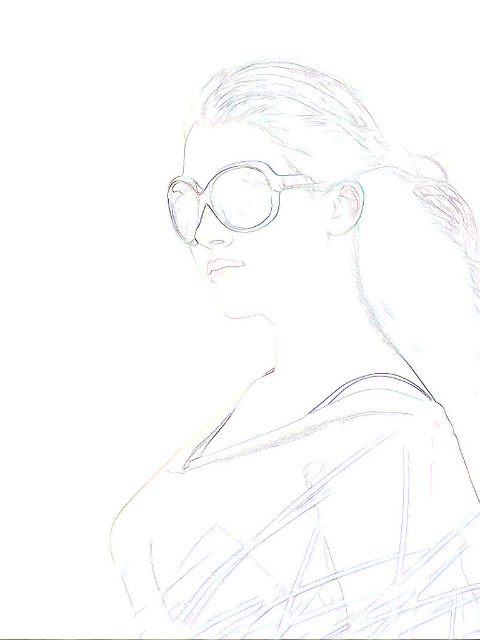
Which is below, matte plastic glasses at center or clear plastic glasses at center?

matte plastic glasses at center

Is matte plastic glasses at center shorter than clear plastic glasses at center?

Incorrect, matte plastic glasses at center's height does not fall short of clear plastic glasses at center's.

The height and width of the screenshot is (640, 480). Find the location of `matte plastic glasses at center`. matte plastic glasses at center is located at coordinates (x=321, y=381).

At what (x,y) coordinates should I click in order to perform the action: click on matte plastic glasses at center. Please return your answer as a coordinate pair (x, y). The image size is (480, 640). Looking at the image, I should click on (321, 381).